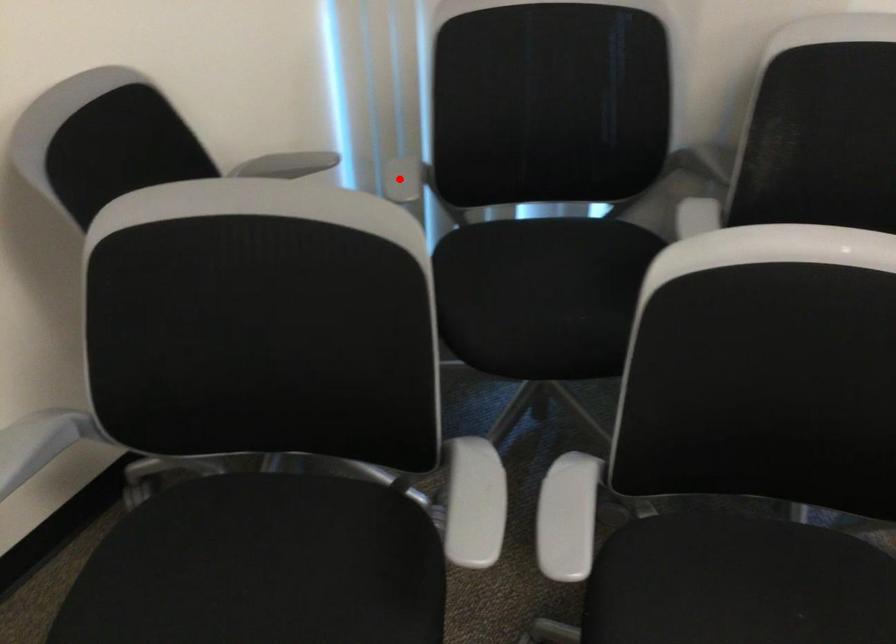
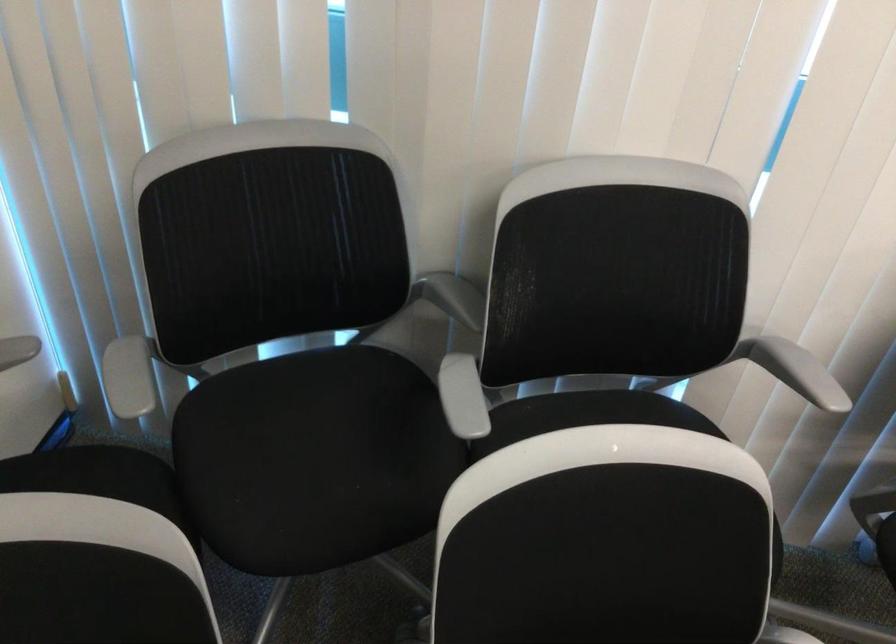
The point at the highlighted location is marked in the first image. Where is the corresponding point in the second image?

(131, 377)